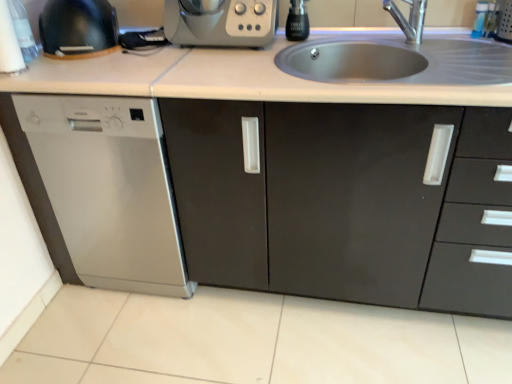
Find the location of a particular element. The width and height of the screenshot is (512, 384). free point in front of satin silver appliance at upper center is located at coordinates (206, 71).